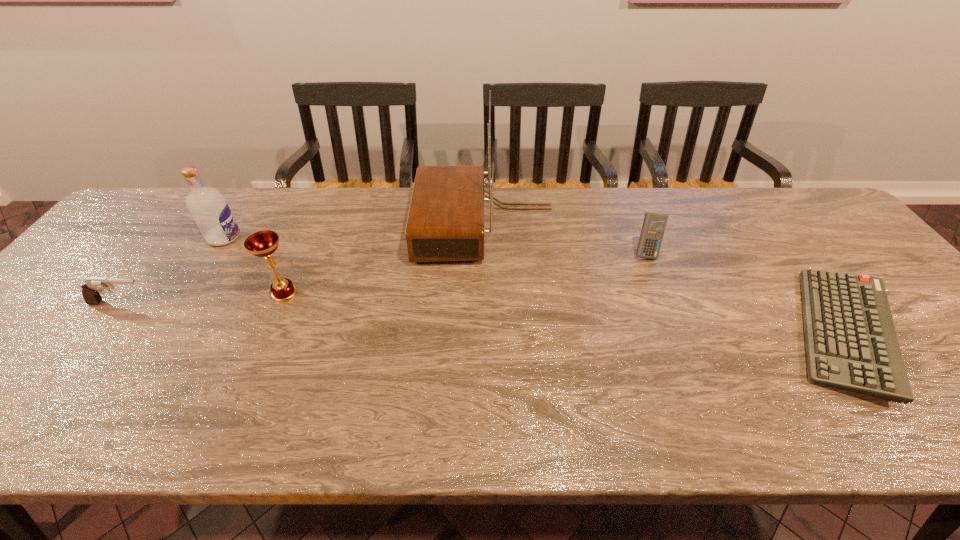
Find the location of `free area in between the tallest object and the vodka`. free area in between the tallest object and the vodka is located at coordinates (355, 232).

Identify the location of free spot between the fourth object from left to right and the third shortest object. (565, 239).

Choose which object is the nearest neighbor to the fourth object from right to left. Please provide its 2D coordinates. Your answer should be formatted as a tuple, i.e. [(x, y)], where the tuple contains the x and y coordinates of a point satisfying the conditions above.

[(209, 209)]

Select which object appears as the second closest to the fourth tallest object. Please provide its 2D coordinates. Your answer should be formatted as a tuple, i.e. [(x, y)], where the tuple contains the x and y coordinates of a point satisfying the conditions above.

[(445, 222)]

Where is `vacant region that satisfies the following two spatial constraints: 1. on the label of the third object from left to right; 2. on the right side of the vodka`? Image resolution: width=960 pixels, height=540 pixels. vacant region that satisfies the following two spatial constraints: 1. on the label of the third object from left to right; 2. on the right side of the vodka is located at coordinates (189, 293).

This screenshot has width=960, height=540. I want to click on vacant space that satisfies the following two spatial constraints: 1. on the front panel of the radio_receiver; 2. on the front side of the third object from left to right, so click(486, 293).

Image resolution: width=960 pixels, height=540 pixels. In order to click on vacant area in the image that satisfies the following two spatial constraints: 1. on the label of the vodka; 2. on the left side of the chalice in this screenshot , I will do `click(189, 293)`.